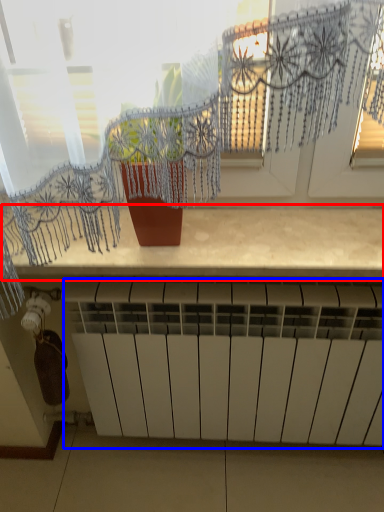
Question: Which of the following is the farthest to the observer, counter top (highlighted by a red box) or radiator (highlighted by a blue box)?

Choices:
 (A) counter top
 (B) radiator

Answer: (B)